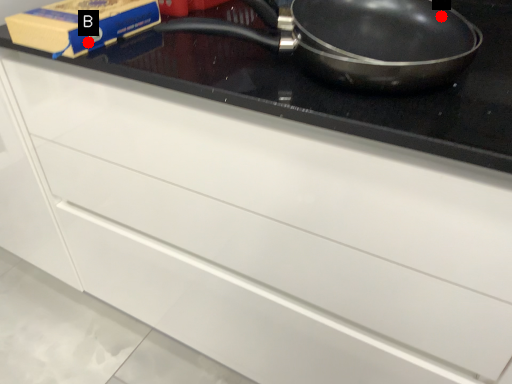
Question: Two points are circled on the image, labeled by A and B beside each circle. Which of the following is the closest to the observer?

Choices:
 (A) A is closer
 (B) B is closer

Answer: (A)